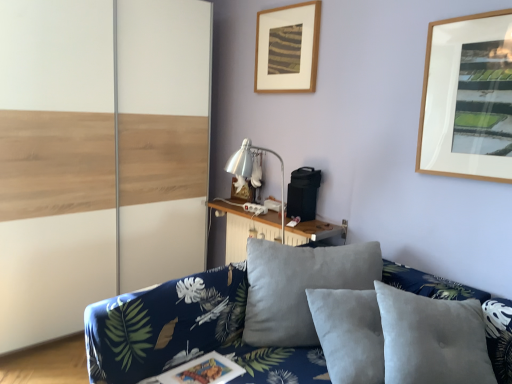
Question: Is suede gray pillow at center in front of or behind blue floral fabric couch at lower center in the image?

Choices:
 (A) front
 (B) behind

Answer: (B)

Question: Looking at their shapes, would you say suede gray pillow at center is wider or thinner than blue floral fabric couch at lower center?

Choices:
 (A) thin
 (B) wide

Answer: (A)

Question: Estimate the real-world distances between objects in this image. Which object is closer to the suede gray pillow at center?

Choices:
 (A) wooden table at center
 (B) blue floral fabric couch at lower center
 (C) white wood barn door at left
 (D) wooden picture frame at upper center, arranged as the 1th picture frame when viewed from the front
 (E) wooden picture frame at upper center, which ranks as the 1th picture frame in bottom-to-top order

Answer: (B)

Question: Which object is positioned closest to the wooden picture frame at upper center, which is the second picture frame in right-to-left order?

Choices:
 (A) wooden table at center
 (B) white wood barn door at left
 (C) blue floral fabric couch at lower center
 (D) wooden picture frame at upper center, the second picture frame ordered from the bottom
 (E) suede gray pillow at center

Answer: (A)